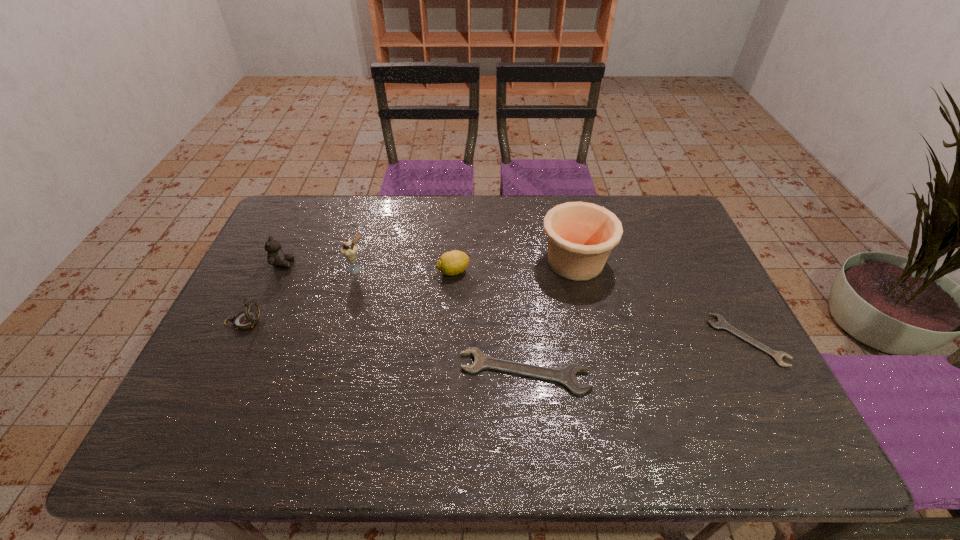
Where is `free space between the rightmost object and the third shortest object`? This screenshot has height=540, width=960. free space between the rightmost object and the third shortest object is located at coordinates (600, 306).

Find the location of a particular element. The image size is (960, 540). free space between the rightmost object and the pottery is located at coordinates (661, 301).

This screenshot has height=540, width=960. What are the coordinates of `vacant space in between the fifth object from right to left and the compass` in the screenshot? It's located at (300, 295).

This screenshot has height=540, width=960. What are the coordinates of `free space between the compass and the shorter wrench` in the screenshot? It's located at (495, 331).

This screenshot has width=960, height=540. I want to click on empty space that is in between the compass and the taller wrench, so click(x=384, y=347).

I want to click on object that ranks as the fourth closest to the compass, so click(x=566, y=376).

Select which object appears as the sixth closest to the taller wrench. Please provide its 2D coordinates. Your answer should be formatted as a tuple, i.e. [(x, y)], where the tuple contains the x and y coordinates of a point satisfying the conditions above.

[(276, 257)]

Find the location of a particular element. vacant region that satisfies the following two spatial constraints: 1. on the front side of the sixth tallest object; 2. on the right side of the icecream is located at coordinates (326, 372).

Where is `vacant space that satisfies the following two spatial constraints: 1. on the face of the compass; 2. on the right side of the left wrench`? The height and width of the screenshot is (540, 960). vacant space that satisfies the following two spatial constraints: 1. on the face of the compass; 2. on the right side of the left wrench is located at coordinates (219, 372).

Where is `free space that satisfies the following two spatial constraints: 1. on the back side of the fifth object from right to left; 2. on the face of the teddy bear`? Image resolution: width=960 pixels, height=540 pixels. free space that satisfies the following two spatial constraints: 1. on the back side of the fifth object from right to left; 2. on the face of the teddy bear is located at coordinates (357, 264).